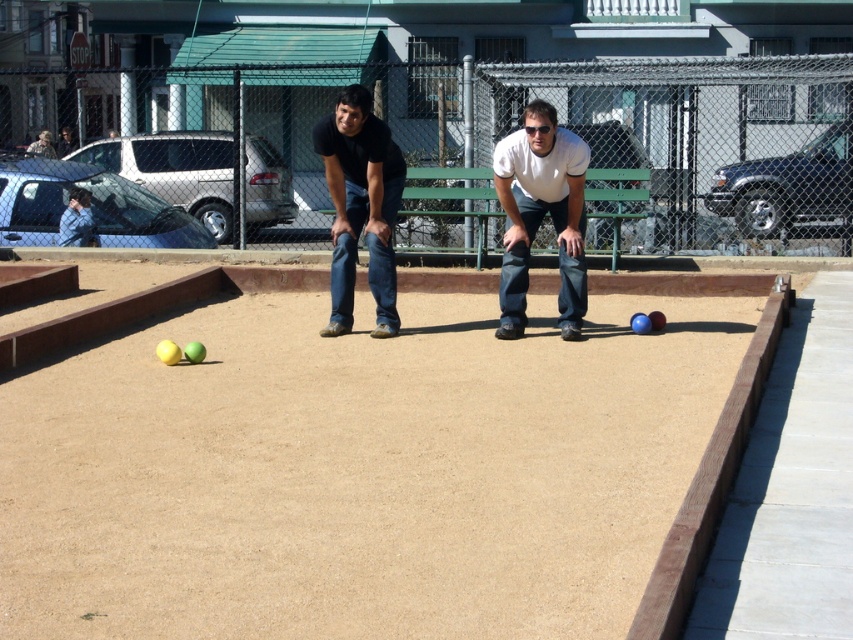
Question: Among these objects, which one is nearest to the camera?

Choices:
 (A) white matte shirt at center
 (B) black matte jeans at center

Answer: (A)

Question: Is white matte shirt at center positioned before black matte jeans at center?

Choices:
 (A) no
 (B) yes

Answer: (B)

Question: Which point is farther to the camera?

Choices:
 (A) black matte jeans at center
 (B) white matte shirt at center

Answer: (A)

Question: Does white matte shirt at center appear on the left side of black matte jeans at center?

Choices:
 (A) no
 (B) yes

Answer: (A)

Question: Among these points, which one is farthest from the camera?

Choices:
 (A) (578, 252)
 (B) (339, 93)

Answer: (A)

Question: Is white matte shirt at center positioned in front of black matte jeans at center?

Choices:
 (A) yes
 (B) no

Answer: (A)